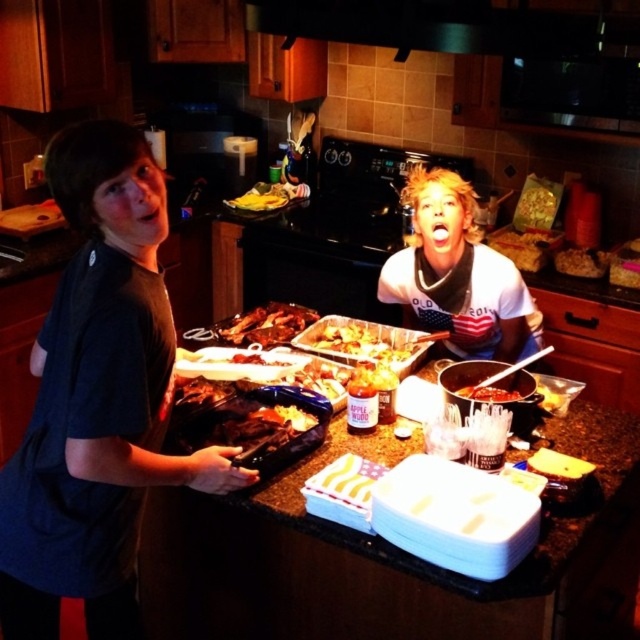
Consider the image. You are a chef standing in the kitchen and want to grab the golden crispy chicken at center and the yellow banana at upper center. Which one do you need to reach further to get?

The yellow banana at upper center requires reaching further because it is farther from the viewer compared to the golden crispy chicken at center.

You are a chef preparing a dish and need to arrange the golden brown crispy chicken at center and the brown crumbly cookie at center on a plate. Which of the two items is shorter in height?

The golden brown crispy chicken at center has a lesser height compared to the brown crumbly cookie at center, so the golden brown crispy chicken at center is shorter in height.

You are a photographer setting up a camera to capture the dark blue shirt at left and the golden crispy chicken at center. The camera has a focus range that can only accommodate objects within 1 meter of each other in width. Can both objects fit within the focus range?

The dark blue shirt at left might be wider than golden crispy chicken at center, but since the exact width difference isn